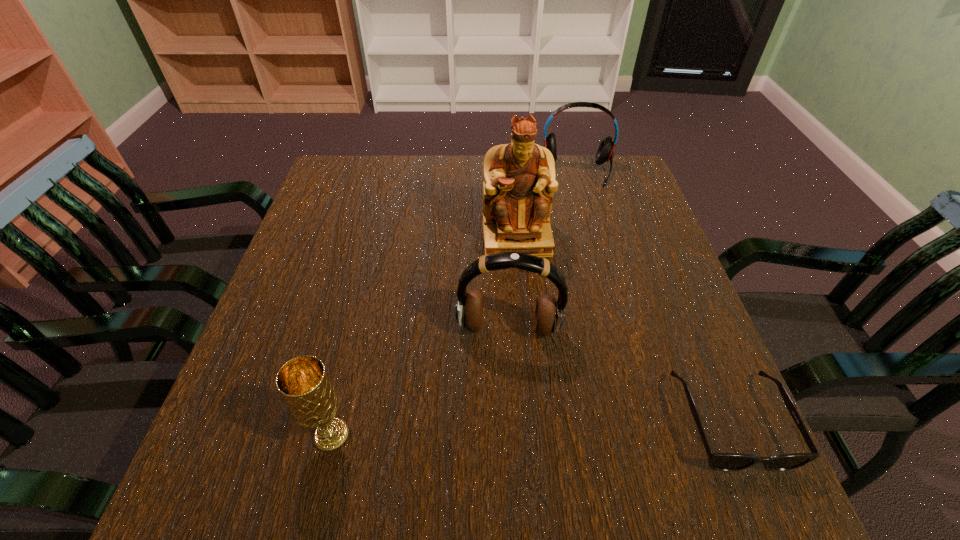
The width and height of the screenshot is (960, 540). I want to click on unoccupied area between the chalice and the shortest object, so click(531, 428).

Identify which object is the closest to the left headset. Please provide its 2D coordinates. Your answer should be formatted as a tuple, i.e. [(x, y)], where the tuple contains the x and y coordinates of a point satisfying the conditions above.

[(519, 183)]

Locate which object is the fourth closest to the leftmost object. Please provide its 2D coordinates. Your answer should be formatted as a tuple, i.e. [(x, y)], where the tuple contains the x and y coordinates of a point satisfying the conditions above.

[(605, 151)]